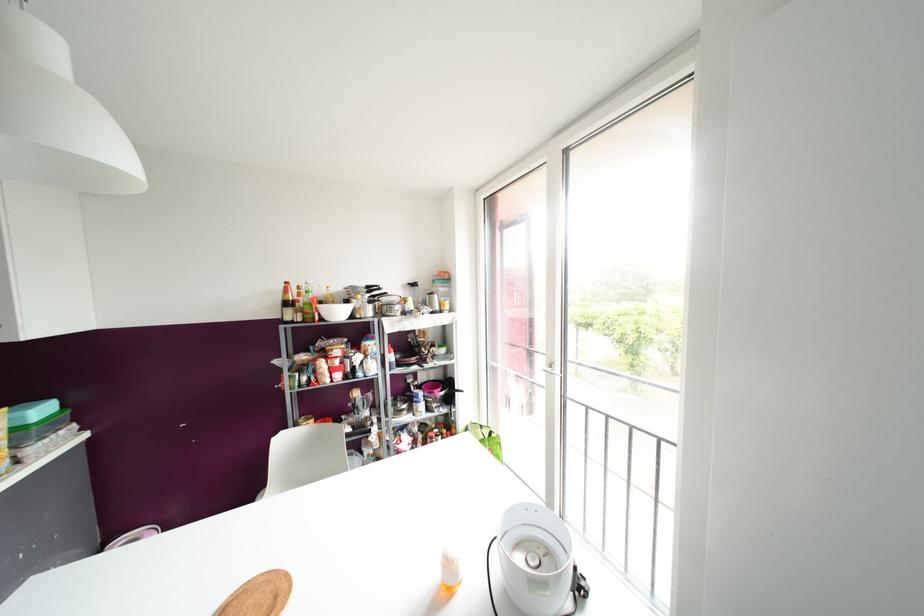
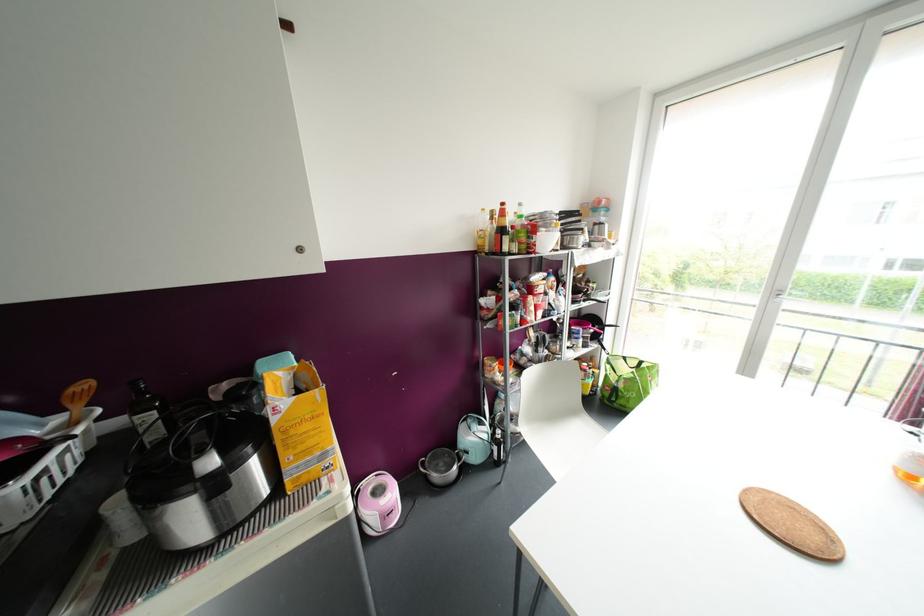
Find the pixel in the second image that matches [286,282] in the first image.

(502, 204)